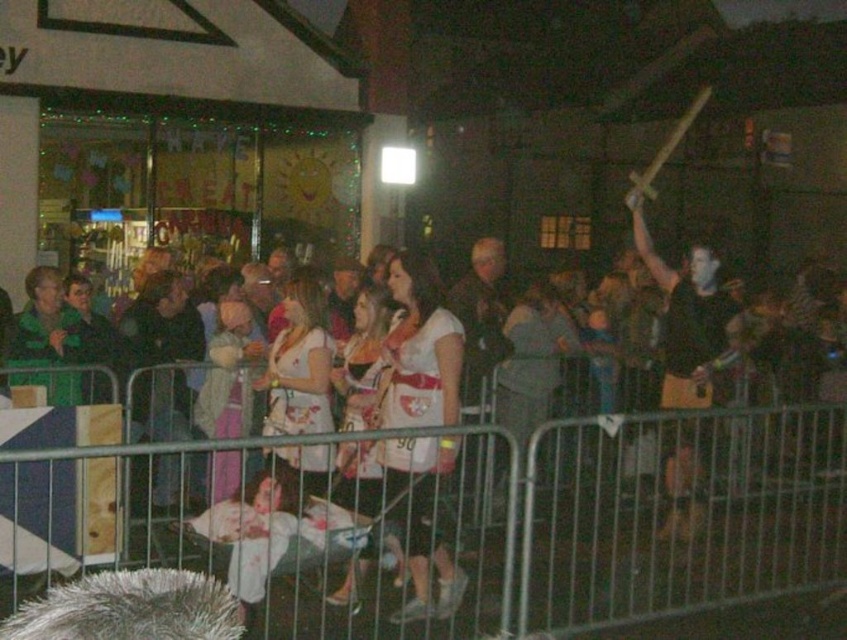
You are a photographer at the event and want to capture the metal at center and white matte shirt at center in a single frame. Which object should you focus on first to ensure both are in focus?

The metal at center is located below white matte shirt at center, so you should focus on the white matte shirt at center first since it is closer to the camera. This will ensure both objects are in focus as the metal is behind it.

You are at the event and need to identify which of the two shirts is shorter. Which one is shorter between the white matte shirt at center and the black matte shirt at upper right?

The white matte shirt at center is shorter than the black matte shirt at upper right.